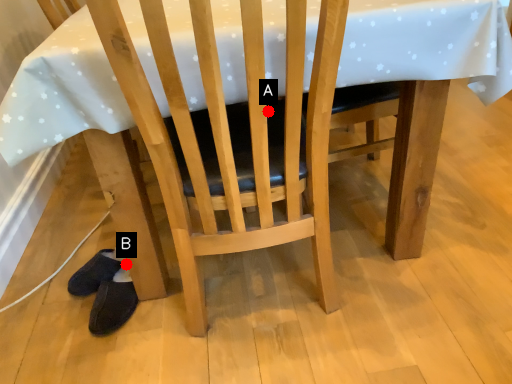
Question: Two points are circled on the image, labeled by A and B beside each circle. Which point is closer to the camera taking this photo?

Choices:
 (A) A is closer
 (B) B is closer

Answer: (A)